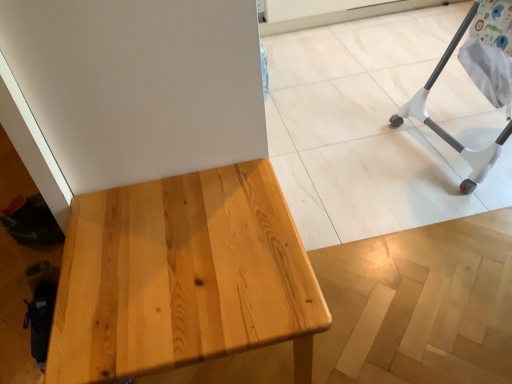
This screenshot has width=512, height=384. I want to click on free space to the left of white plastic baby bouncer at right, so click(352, 160).